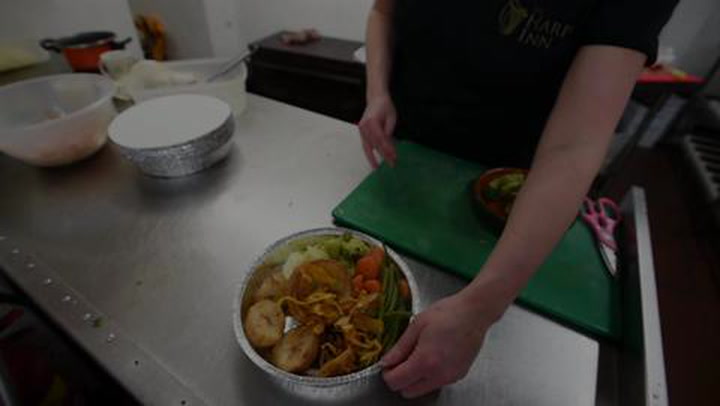
Locate an element on the screen. Image resolution: width=720 pixels, height=406 pixels. plastic bins for food storage is located at coordinates (x=60, y=108), (x=238, y=92).